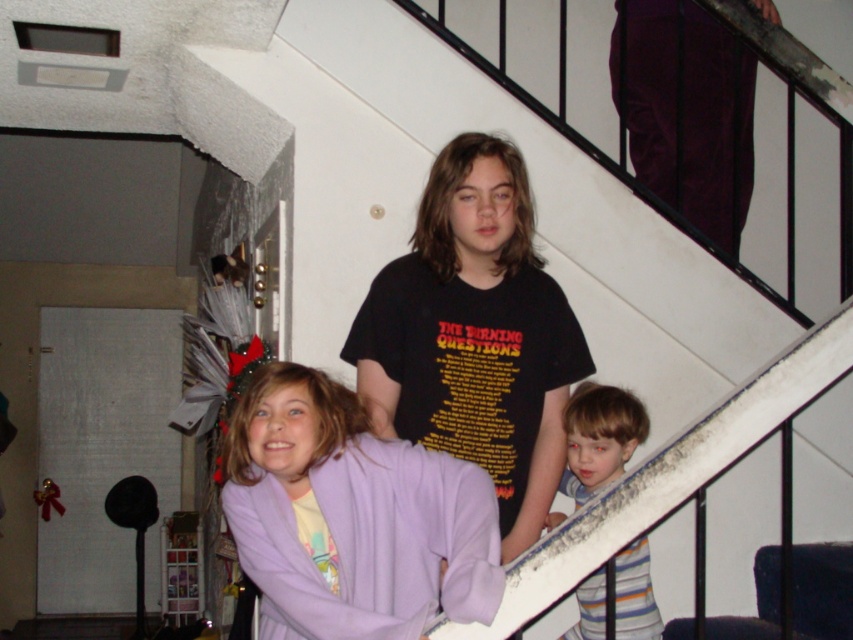
Question: Is white matte stairwell at upper center positioned before purple soft fabric at center?

Choices:
 (A) yes
 (B) no

Answer: (B)

Question: Which object appears farthest from the camera in this image?

Choices:
 (A) purple soft fabric at center
 (B) white matte stairwell at upper center

Answer: (B)

Question: Among these points, which one is farthest from the camera?

Choices:
 (A) (840, 387)
 (B) (311, 509)

Answer: (A)

Question: Is white matte stairwell at upper center further to camera compared to striped cotton shirt at lower right?

Choices:
 (A) no
 (B) yes

Answer: (B)

Question: Among these points, which one is farthest from the camera?

Choices:
 (A) coord(306,628)
 (B) coord(584,588)

Answer: (B)

Question: Does purple soft fabric at center appear on the left side of striped cotton shirt at lower right?

Choices:
 (A) yes
 (B) no

Answer: (A)